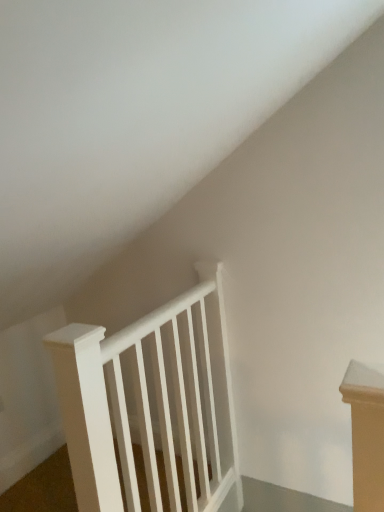
Identify the location of white matte wooden rail at center. The width and height of the screenshot is (384, 512). (149, 404).

What do you see at coordinates (149, 404) in the screenshot? This screenshot has height=512, width=384. I see `white matte wooden rail at center` at bounding box center [149, 404].

The height and width of the screenshot is (512, 384). I want to click on white matte wooden rail at center, so click(x=149, y=404).